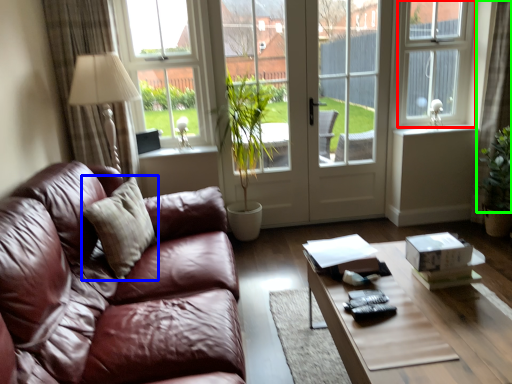
Question: Estimate the real-world distances between objects in this image. Which object is farther from window frame (highlighted by a red box), pillow (highlighted by a blue box) or curtain (highlighted by a green box)?

Choices:
 (A) pillow
 (B) curtain

Answer: (A)